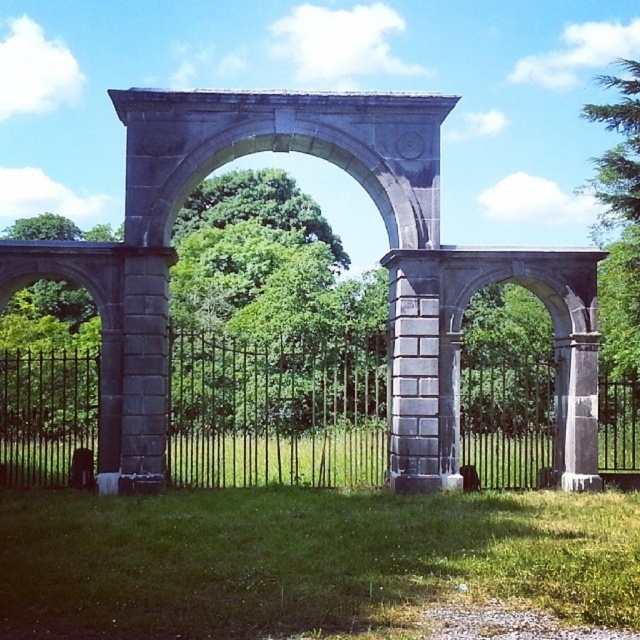
Question: Among these objects, which one is farthest from the camera?

Choices:
 (A) green grass at lower center
 (B) green leafy tree at upper right

Answer: (B)

Question: Can you confirm if green grass at lower center is positioned below green leafy tree at upper right?

Choices:
 (A) yes
 (B) no

Answer: (A)

Question: Is green grass at lower center bigger than black wrought iron fence at center?

Choices:
 (A) no
 (B) yes

Answer: (A)

Question: Among these objects, which one is nearest to the camera?

Choices:
 (A) green grass at lower center
 (B) black wrought iron fence at center
 (C) green leafy tree at upper right

Answer: (A)

Question: Can you confirm if black wrought iron fence at center is positioned below green leafy tree at upper right?

Choices:
 (A) yes
 (B) no

Answer: (A)

Question: Among these objects, which one is nearest to the camera?

Choices:
 (A) green leafy tree at upper right
 (B) green grass at lower center
 (C) black wrought iron fence at center

Answer: (B)